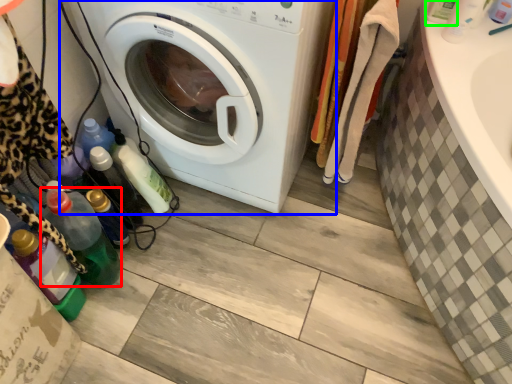
Question: Estimate the real-world distances between objects in this image. Which object is farther from bottle (highlighted by a red box), washing machine (highlighted by a blue box) or bottle (highlighted by a green box)?

Choices:
 (A) washing machine
 (B) bottle

Answer: (B)